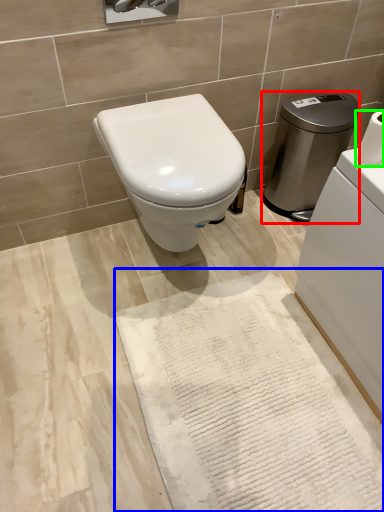
Question: Which object is the farthest from water heater (highlighted by a red box)? Choose among these: bath mat (highlighted by a blue box) or toilet paper (highlighted by a green box).

Choices:
 (A) bath mat
 (B) toilet paper

Answer: (A)